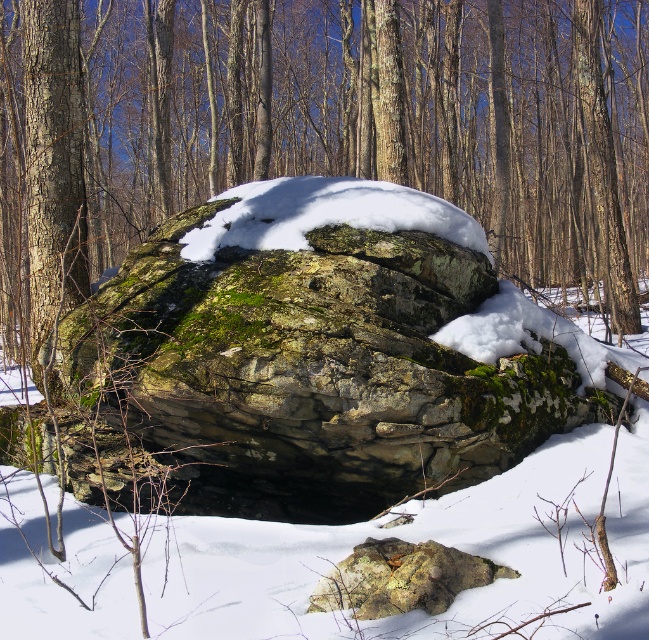
Does green mossy rock at center appear under green mossy rock at lower center?

Incorrect, green mossy rock at center is not positioned below green mossy rock at lower center.

Is green mossy rock at center further to camera compared to green mossy rock at lower center?

Yes.

This screenshot has height=640, width=649. Describe the element at coordinates (321, 353) in the screenshot. I see `green mossy rock at center` at that location.

This screenshot has height=640, width=649. I want to click on green mossy rock at center, so click(x=321, y=353).